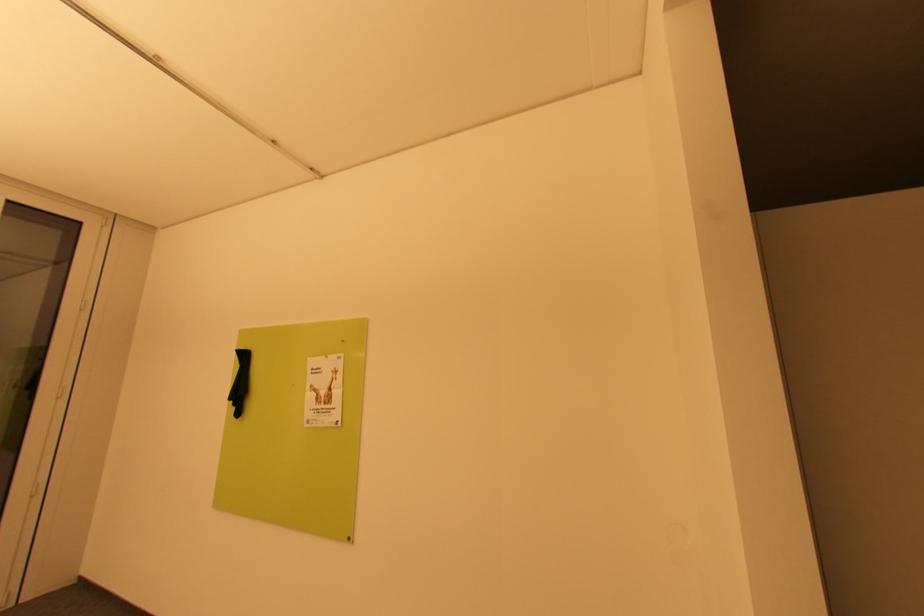
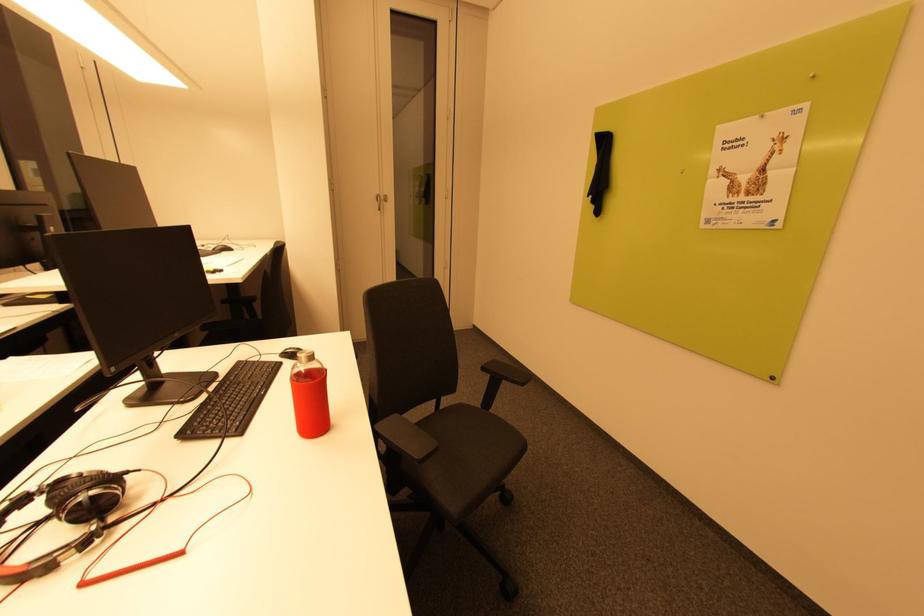
How did the camera likely rotate?

The camera's rotation is toward left-down.